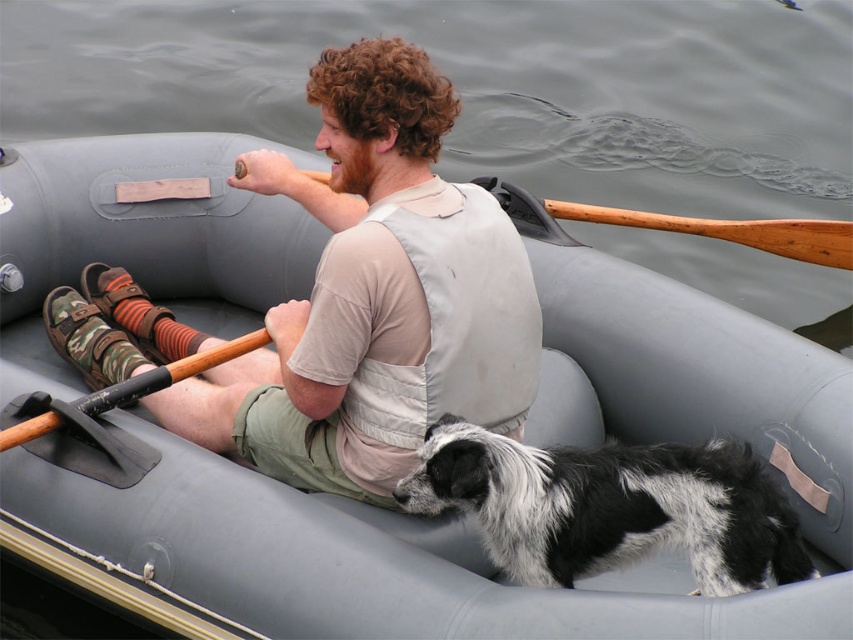
Question: Can you confirm if black and white fur dog at center is wider than wooden paddle at upper center?

Choices:
 (A) no
 (B) yes

Answer: (A)

Question: Which object is the farthest from the wooden paddle at upper center?

Choices:
 (A) camouflage-patterned sandal at lower left
 (B) black and white fur dog at center

Answer: (B)

Question: Which point appears farthest from the camera in this image?

Choices:
 (A) (666, 454)
 (B) (467, 300)
 (C) (834, 266)

Answer: (C)

Question: Can you confirm if black and white fur dog at center is smaller than wooden paddle at upper center?

Choices:
 (A) no
 (B) yes

Answer: (B)

Question: Can you confirm if camouflage-patterned sandal at lower left is bigger than black and white fur dog at center?

Choices:
 (A) yes
 (B) no

Answer: (A)

Question: Which object is closer to the camera taking this photo?

Choices:
 (A) black and white fur dog at center
 (B) wooden paddle at upper center
 (C) camouflage-patterned sandal at lower left

Answer: (A)